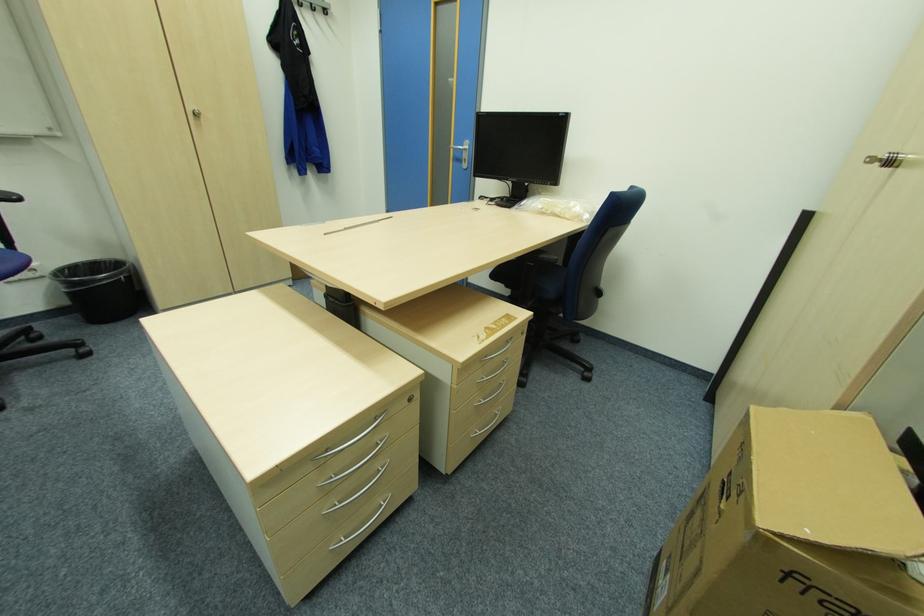
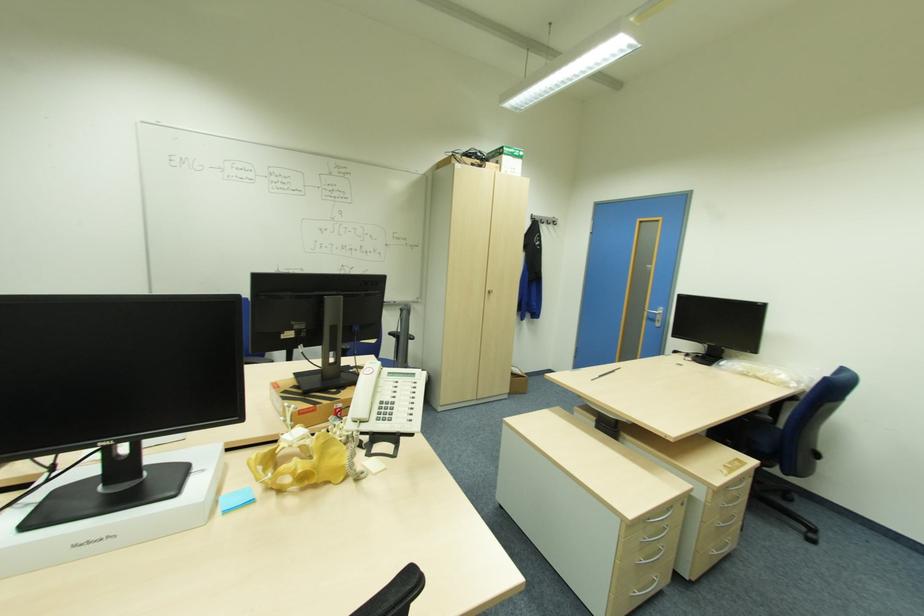
Question: I am providing you with two images of the same scene from different viewpoints. After the viewpoint changes to image2, which objects are now occluded?

Choices:
 (A) white cardboard box
 (B) wrapped canvas
 (C) black trash can
 (D) silver door handle

Answer: (C)